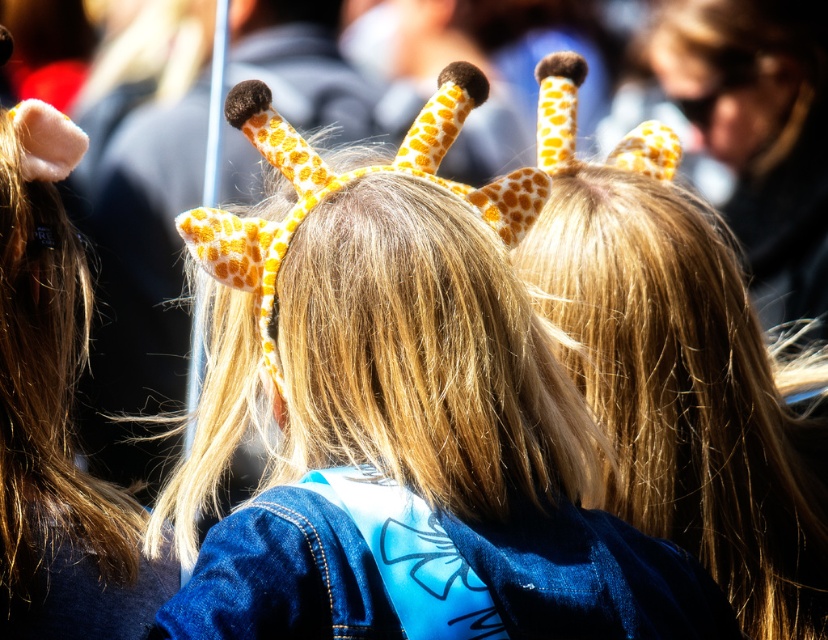
Is blonde silky hair at center shorter than yellow dotted fabric giraffe ears at upper center?

No.

Between point (739, 602) and point (656, 13), which one is positioned in front?

Point (739, 602)

Locate an element on the screen. The image size is (828, 640). blonde silky hair at center is located at coordinates click(686, 390).

Locate an element on the screen. blonde silky hair at center is located at coordinates (686, 390).

Where is `matte yellow giraffe headband at center`? This screenshot has width=828, height=640. matte yellow giraffe headband at center is located at coordinates (402, 417).

The width and height of the screenshot is (828, 640). Describe the element at coordinates (402, 417) in the screenshot. I see `matte yellow giraffe headband at center` at that location.

I want to click on matte yellow giraffe headband at center, so click(402, 417).

Describe the element at coordinates (686, 390) in the screenshot. I see `blonde silky hair at center` at that location.

Does blonde silky hair at center come in front of denim jacket at lower right?

No, blonde silky hair at center is further to the viewer.

Describe the element at coordinates (686, 390) in the screenshot. This screenshot has width=828, height=640. I see `blonde silky hair at center` at that location.

Find the location of a particular element. Image resolution: width=828 pixels, height=640 pixels. blonde silky hair at center is located at coordinates (686, 390).